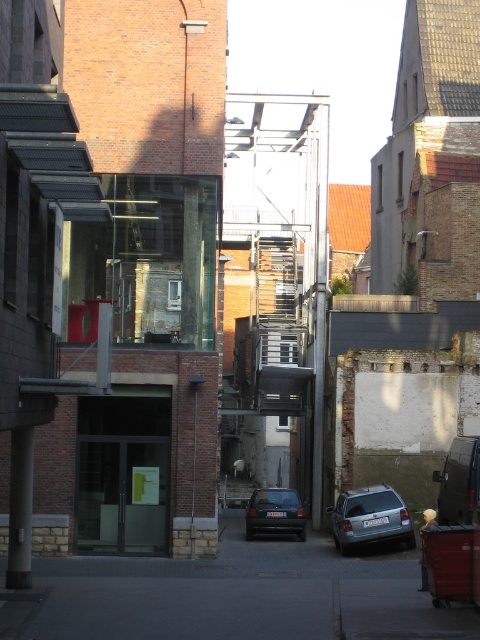
How distant is satin silver car at lower center from dark gray matte car at center?

They are 14.03 feet apart.

Does satin silver car at lower center have a greater width compared to dark gray matte car at center?

Correct, the width of satin silver car at lower center exceeds that of dark gray matte car at center.

Which is behind, point (344, 497) or point (266, 488)?

The point (266, 488) is more distant.

Locate an element on the screen. The image size is (480, 640). satin silver car at lower center is located at coordinates (370, 516).